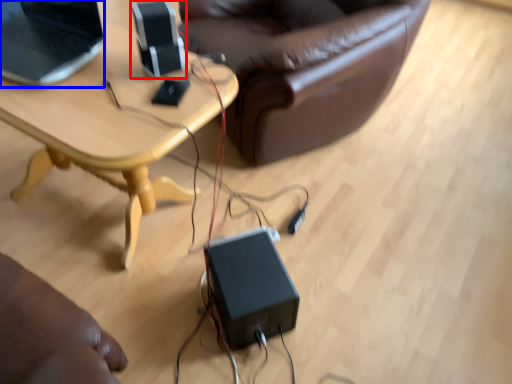
Question: Which object appears farthest to the camera in this image, speaker (highlighted by a red box) or laptop (highlighted by a blue box)?

Choices:
 (A) speaker
 (B) laptop

Answer: (A)